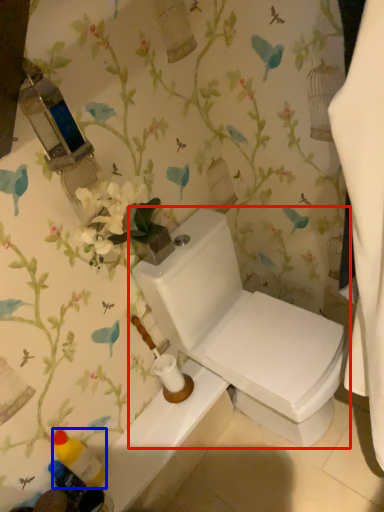
Question: Which object is further to the camera taking this photo, toilet (highlighted by a red box) or toiletry (highlighted by a blue box)?

Choices:
 (A) toilet
 (B) toiletry

Answer: (B)